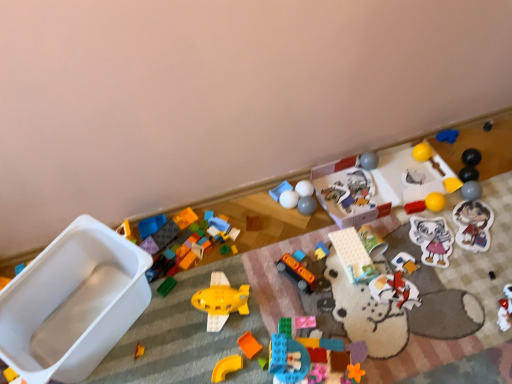
Where is `vacant area that lies between white matte figure at center, placed as the seventh toy when sorted from right to left, and yellow plastic curve at center, the fifth toy in the left-to-right sequence`? Image resolution: width=512 pixels, height=384 pixels. vacant area that lies between white matte figure at center, placed as the seventh toy when sorted from right to left, and yellow plastic curve at center, the fifth toy in the left-to-right sequence is located at coordinates (330, 313).